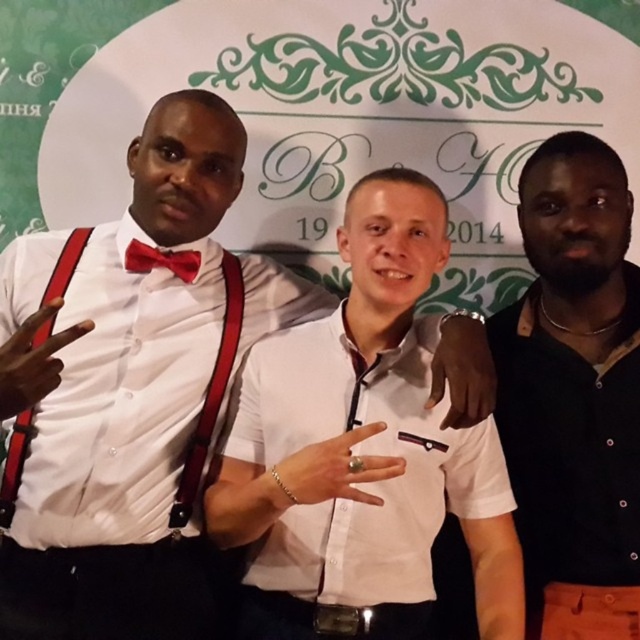
Question: Estimate the real-world distances between objects in this image. Which object is farther from the white matte shirt at center?

Choices:
 (A) red leather suspenders at left
 (B) white satin shirt at center

Answer: (A)

Question: Can you confirm if black leather jacket at right is wider than red satin bow tie at left?

Choices:
 (A) no
 (B) yes

Answer: (B)

Question: Which object appears farthest from the camera in this image?

Choices:
 (A) white satin shirt at center
 (B) black leather jacket at right
 (C) white matte shirt at center

Answer: (B)

Question: Is black leather jacket at right in front of red leather suspenders at left?

Choices:
 (A) yes
 (B) no

Answer: (A)

Question: Estimate the real-world distances between objects in this image. Which object is closer to the black leather jacket at right?

Choices:
 (A) red leather suspenders at left
 (B) white matte shirt at center

Answer: (B)

Question: Is white satin shirt at center to the left of red satin bow tie at left from the viewer's perspective?

Choices:
 (A) yes
 (B) no

Answer: (A)